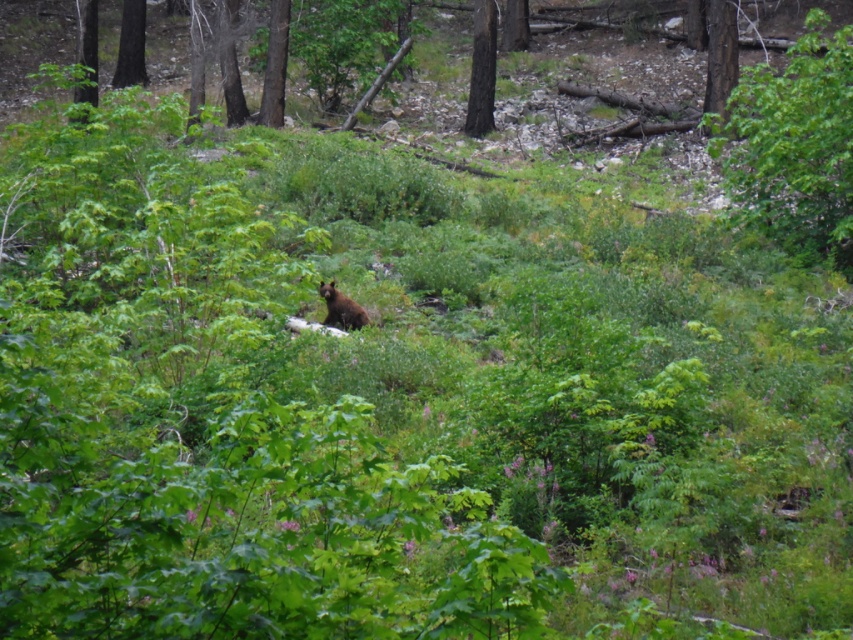
Question: Which of these objects is positioned farthest from the smooth bark tree at upper right?

Choices:
 (A) brown furry bear at center
 (B) green leafy tree at upper right

Answer: (A)

Question: Which of the following is the farthest from the observer?

Choices:
 (A) smooth dark brown tree trunk at center
 (B) smooth bark tree at upper right
 (C) smooth brown tree trunk at upper left

Answer: (C)

Question: Is green leafy tree at upper right thinner than smooth brown tree trunk at upper left?

Choices:
 (A) no
 (B) yes

Answer: (A)

Question: Can you confirm if green leafy tree at upper right is positioned to the left of smooth brown tree trunk at upper left?

Choices:
 (A) yes
 (B) no

Answer: (B)

Question: Can you confirm if brown wood tree at upper center is positioned above smooth bark tree at upper left?

Choices:
 (A) yes
 (B) no

Answer: (A)

Question: Estimate the real-world distances between objects in this image. Which object is closer to the smooth bark tree at upper left?

Choices:
 (A) smooth brown tree trunk at upper left
 (B) brown furry bear at center
 (C) brown wood tree at upper center

Answer: (A)